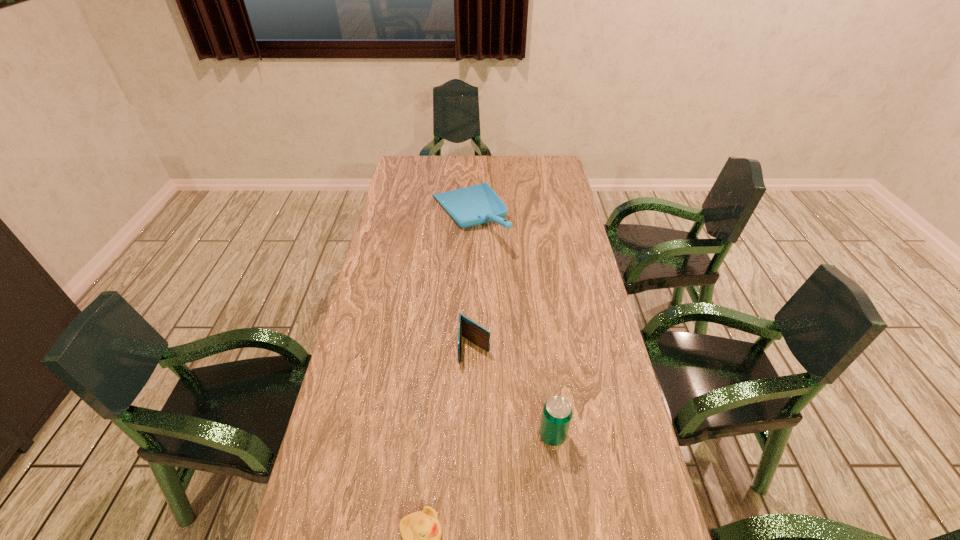
Find the location of a particular element. the farthest object is located at coordinates (474, 205).

Identify the location of the third farthest object. (557, 413).

Find the location of a particular element. This screenshot has width=960, height=540. beer can is located at coordinates (557, 413).

At what (x,y) coordinates should I click in order to perform the action: click on the second farthest object. Please return your answer as a coordinate pair (x, y). This screenshot has width=960, height=540. Looking at the image, I should click on (478, 335).

The height and width of the screenshot is (540, 960). In order to click on wallet in this screenshot , I will do `click(478, 335)`.

Where is `free space located 0.160m on the left of the dustpan`? This screenshot has height=540, width=960. free space located 0.160m on the left of the dustpan is located at coordinates (387, 217).

At what (x,y) coordinates should I click in order to perform the action: click on blank area located 0.120m on the front of the rightmost object. Please return your answer as a coordinate pair (x, y). Looking at the image, I should click on tap(562, 503).

In order to click on free space located 0.270m on the exterior surface of the second shortest object in this screenshot , I will do `click(473, 463)`.

The width and height of the screenshot is (960, 540). Identify the location of object that is at the right edge. (557, 413).

I want to click on vacant region at the far edge of the desktop, so pyautogui.click(x=474, y=164).